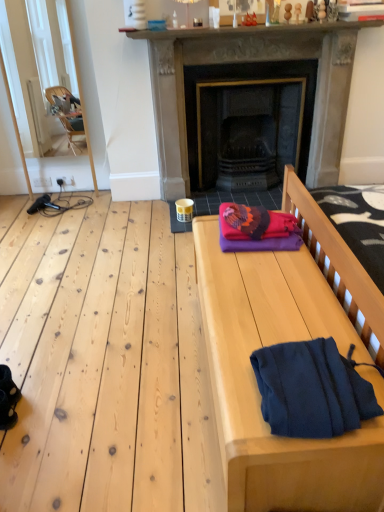
Find the location of a particular element. vacant area in front of knitted woolen blanket at center is located at coordinates (253, 265).